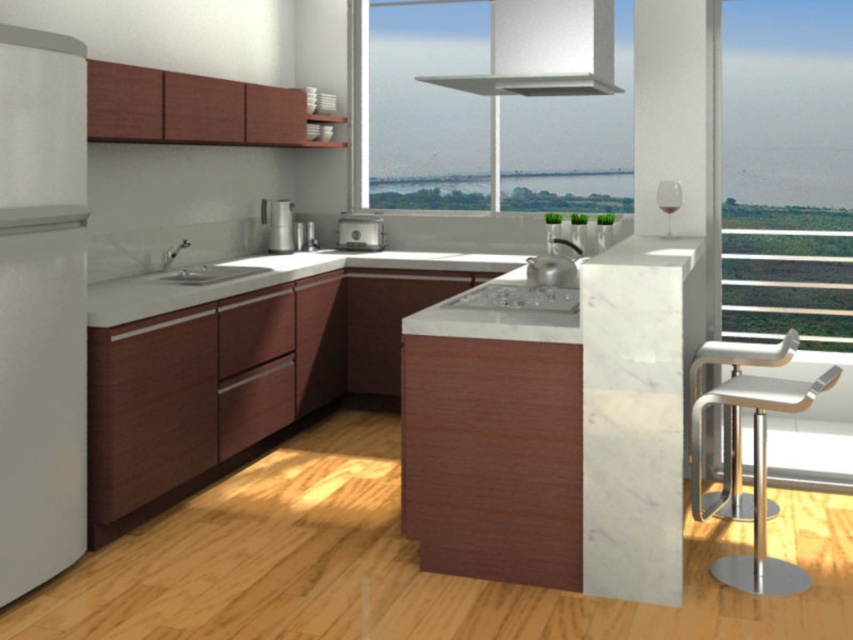
Question: Which point is closer to the camera taking this photo?

Choices:
 (A) (607, 12)
 (B) (804, 435)
 (C) (743, 360)

Answer: (C)

Question: Considering the real-world distances, which object is closest to the satin silver toaster at center?

Choices:
 (A) metallic silver bar stool at right
 (B) transparent glass window at upper center

Answer: (A)

Question: Can you confirm if transparent glass window at right is thinner than metallic silver toaster at center?

Choices:
 (A) yes
 (B) no

Answer: (B)

Question: Which of the following is the farthest from the observer?

Choices:
 (A) (20, 412)
 (B) (769, 582)
 (C) (167, 257)

Answer: (C)

Question: Can you confirm if white textured exhaust hood at upper center is bigger than white glossy sink at center?

Choices:
 (A) no
 (B) yes

Answer: (B)

Question: Does transparent glass window at right have a greater width compared to white matte refrigerator at left?

Choices:
 (A) yes
 (B) no

Answer: (A)